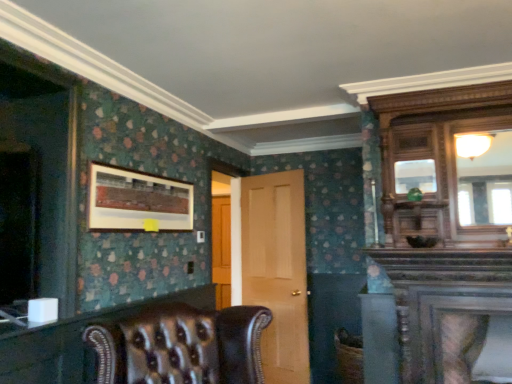
Question: From a real-world perspective, is leather at lower left, the 1th dresser positioned from the left, under leather armchair at center?

Choices:
 (A) no
 (B) yes

Answer: (A)

Question: From the image's perspective, is leather at lower left, acting as the second dresser starting from the top, on top of leather armchair at center?

Choices:
 (A) no
 (B) yes

Answer: (A)

Question: Does leather at lower left, the 1th dresser positioned from the left, have a lesser height compared to leather armchair at center?

Choices:
 (A) yes
 (B) no

Answer: (A)

Question: Is leather at lower left, which ranks as the second dresser in right-to-left order, positioned beyond the bounds of leather armchair at center?

Choices:
 (A) yes
 (B) no

Answer: (A)

Question: From a real-world perspective, is leather at lower left, which ranks as the second dresser in right-to-left order, on leather armchair at center?

Choices:
 (A) no
 (B) yes

Answer: (B)

Question: Does leather at lower left, which ranks as the second dresser in right-to-left order, appear on the right side of leather armchair at center?

Choices:
 (A) no
 (B) yes

Answer: (A)

Question: Is wooden-framed artwork at upper left closer to camera compared to leather at lower left, which ranks as the second dresser in right-to-left order?

Choices:
 (A) yes
 (B) no

Answer: (B)

Question: Is wooden-framed artwork at upper left turned away from leather at lower left, which ranks as the second dresser in right-to-left order?

Choices:
 (A) no
 (B) yes

Answer: (A)

Question: Is wooden-framed artwork at upper left taller than leather at lower left, which ranks as the second dresser in right-to-left order?

Choices:
 (A) no
 (B) yes

Answer: (A)

Question: From the image's perspective, is wooden-framed artwork at upper left below leather at lower left, acting as the second dresser starting from the top?

Choices:
 (A) no
 (B) yes

Answer: (A)

Question: Considering the relative positions of wooden-framed artwork at upper left and leather at lower left, which ranks as the second dresser in right-to-left order, in the image provided, is wooden-framed artwork at upper left to the right of leather at lower left, which ranks as the second dresser in right-to-left order, from the viewer's perspective?

Choices:
 (A) no
 (B) yes

Answer: (B)

Question: Does wooden-framed artwork at upper left come behind leather at lower left, which is counted as the first dresser, starting from the bottom?

Choices:
 (A) no
 (B) yes

Answer: (B)

Question: Is light brown wood door at center aimed at wooden-framed artwork at upper left?

Choices:
 (A) no
 (B) yes

Answer: (B)